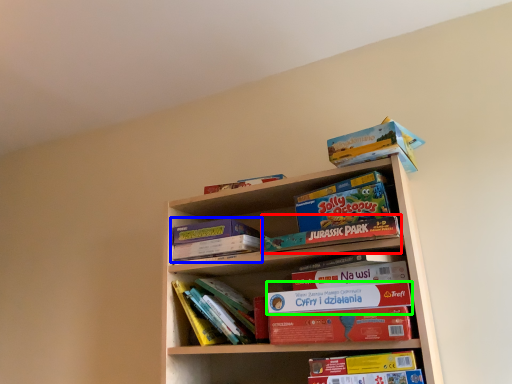
Question: Which is nearer to the paperback book (highlighted by a red box)? paperback book (highlighted by a blue box) or paperback book (highlighted by a green box).

Choices:
 (A) paperback book
 (B) paperback book

Answer: (B)